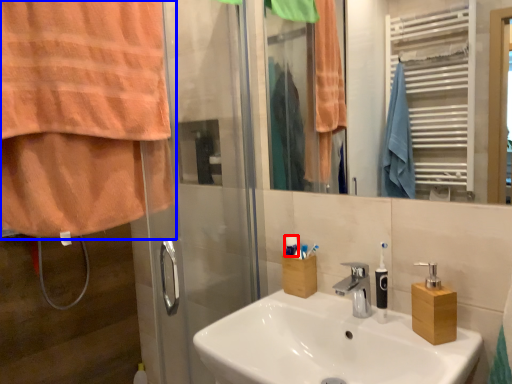
Question: Which object appears farthest to the camera in this image, toiletry (highlighted by a red box) or curtain (highlighted by a blue box)?

Choices:
 (A) toiletry
 (B) curtain

Answer: (A)